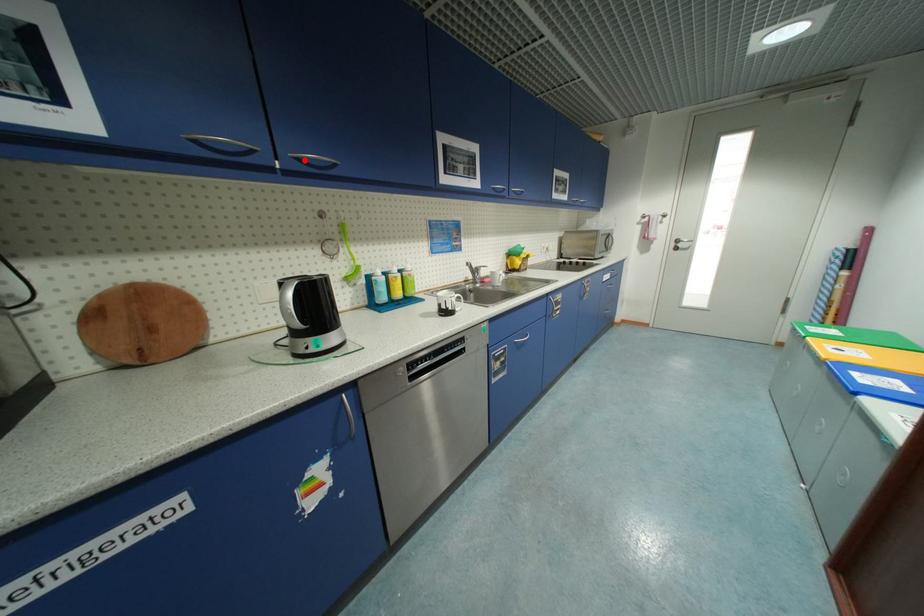
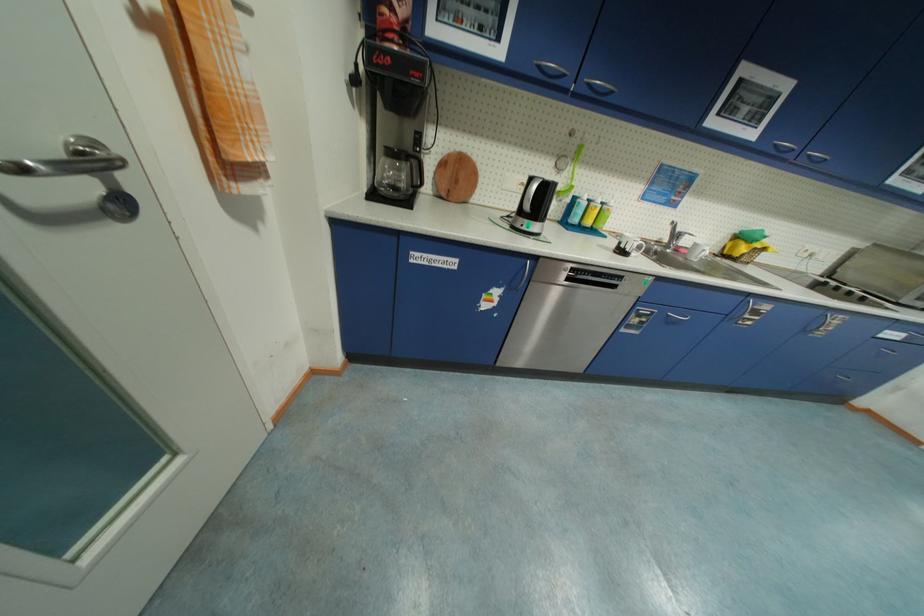
Question: I am providing you with two images of the same scene from different viewpoints. Given a red point in image1, look at the same physical point in image2. Is it:

Choices:
 (A) Closer to the viewpoint
 (B) Farther from the viewpoint

Answer: (A)